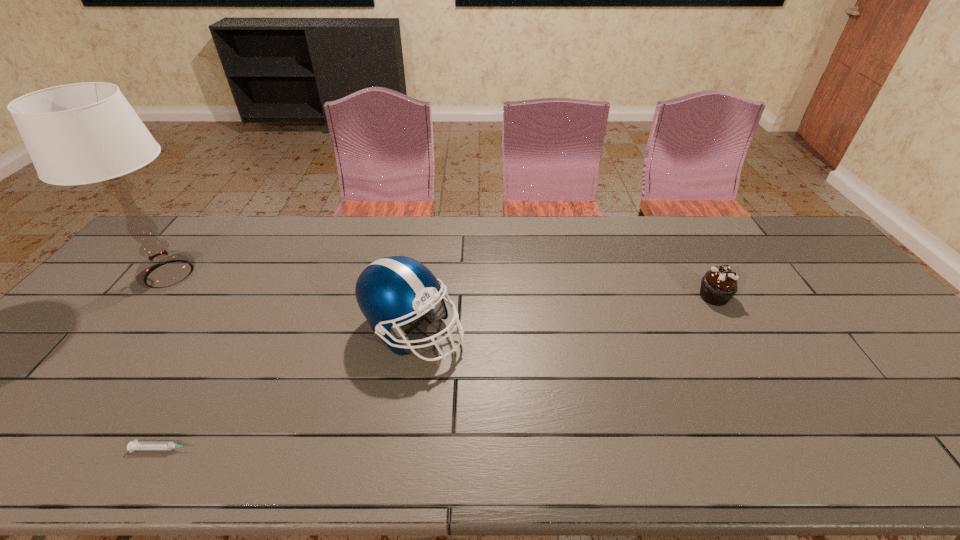
In order to click on vacant space situated on the left of the rightmost object in this screenshot , I will do `click(656, 296)`.

This screenshot has width=960, height=540. I want to click on free space located at the needle end of the nearest object, so 272,448.

Identify the location of object that is at the far edge. The width and height of the screenshot is (960, 540). (x=81, y=133).

Find the location of a particular element. Image resolution: width=960 pixels, height=540 pixels. object positioned at the near edge is located at coordinates (135, 445).

The width and height of the screenshot is (960, 540). What are the coordinates of `object that is at the left edge` in the screenshot? It's located at (81, 133).

The image size is (960, 540). Identify the location of object at the far left corner. (81, 133).

Locate an element on the screen. The height and width of the screenshot is (540, 960). vacant space at the far edge of the desktop is located at coordinates (492, 233).

Locate an element on the screen. This screenshot has height=540, width=960. vacant space at the near edge of the desktop is located at coordinates (83, 461).

The height and width of the screenshot is (540, 960). Find the location of `vacant space at the left edge of the desktop`. vacant space at the left edge of the desktop is located at coordinates (80, 331).

The width and height of the screenshot is (960, 540). What are the coordinates of `vacant space at the near left corner` in the screenshot? It's located at (18, 438).